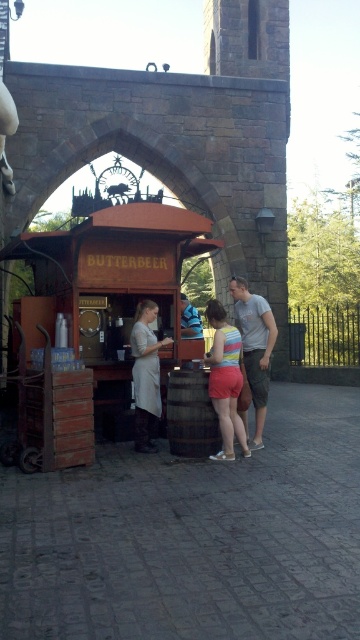
Which is above, striped fabric shorts at center or brown wooden barrel at lower center?

striped fabric shorts at center

Locate an element on the screen. This screenshot has height=640, width=360. striped fabric shorts at center is located at coordinates (225, 380).

What do you see at coordinates (225, 380) in the screenshot? I see `striped fabric shorts at center` at bounding box center [225, 380].

The height and width of the screenshot is (640, 360). Find the location of `striped fabric shorts at center`. striped fabric shorts at center is located at coordinates (225, 380).

Between point (243, 326) and point (204, 419), which one is positioned in front?

Positioned in front is point (204, 419).

Is gray cotton t-shirt at center above brown wooden barrel at lower center?

Correct, gray cotton t-shirt at center is located above brown wooden barrel at lower center.

This screenshot has height=640, width=360. What do you see at coordinates (254, 348) in the screenshot?
I see `gray cotton t-shirt at center` at bounding box center [254, 348].

This screenshot has height=640, width=360. In order to click on gray cotton t-shirt at center in this screenshot , I will do `click(254, 348)`.

Is point (212, 360) in front of point (187, 321)?

Yes.

Between point (216, 355) and point (187, 320), which one is positioned in front?

Point (216, 355) is more forward.

Between point (240, 444) and point (195, 308), which one is positioned in front?

Point (240, 444) is in front.

Find the location of a particular element. striped fabric shorts at center is located at coordinates (225, 380).